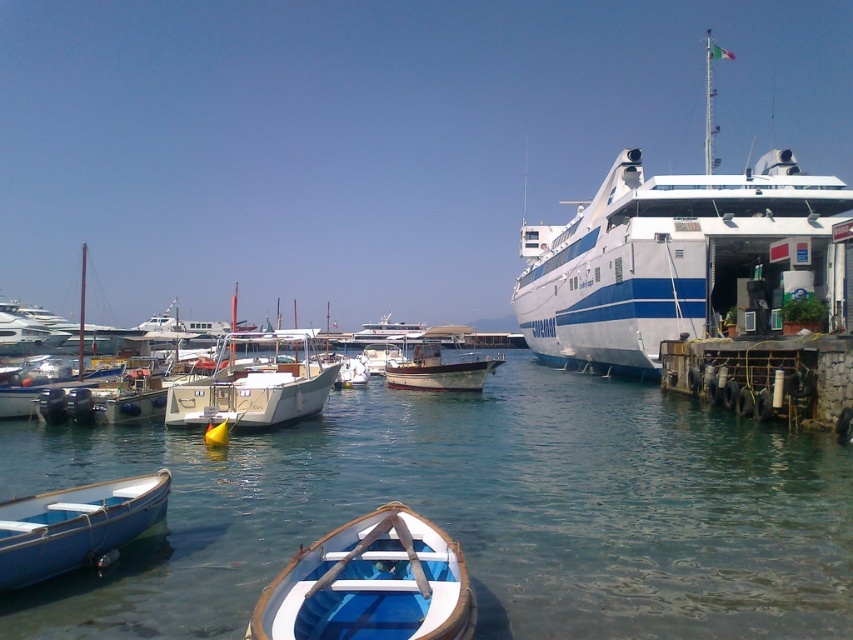
Looking at this image, you are standing on the dock and looking at the clear blue water at center and the white glossy cruise ship at right. Which object is closer to the water surface?

The clear blue water at center is positioned under the white glossy cruise ship at right, so the water is closer to the surface than the ship.

You are standing at the edge of the marina and want to take a photo of the clear blue water at center. Which direction should you point your camera to capture it?

The clear blue water at center is located at point 2D coordinates of (474, 512), so you should point your camera towards the center of the image to capture it.

You are standing on the dock and want to board the white glossy cruise ship at right. However, there is a blue painted wood boat at lower left blocking your path. Can you walk around it to reach the cruise ship?

The white glossy cruise ship at right is located above the blue painted wood boat at lower left, so you can walk around the blue painted wood boat at lower left to reach the cruise ship since it is positioned lower and not directly in front.